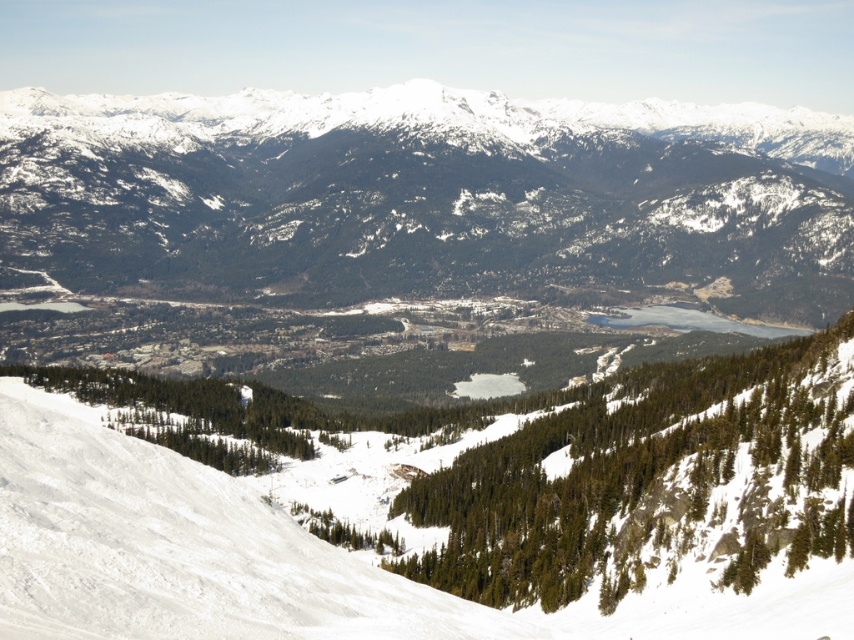
Does snowy forested mountain at center have a lesser height compared to white snow ski slope at lower left?

In fact, snowy forested mountain at center may be taller than white snow ski slope at lower left.

Does snowy forested mountain at center appear on the left side of white snow ski slope at lower left?

In fact, snowy forested mountain at center is to the right of white snow ski slope at lower left.

Who is more distant from viewer, (826, 132) or (361, 621)?

The point (826, 132) is behind.

Locate an element on the screen. The width and height of the screenshot is (854, 640). snowy forested mountain at center is located at coordinates (425, 196).